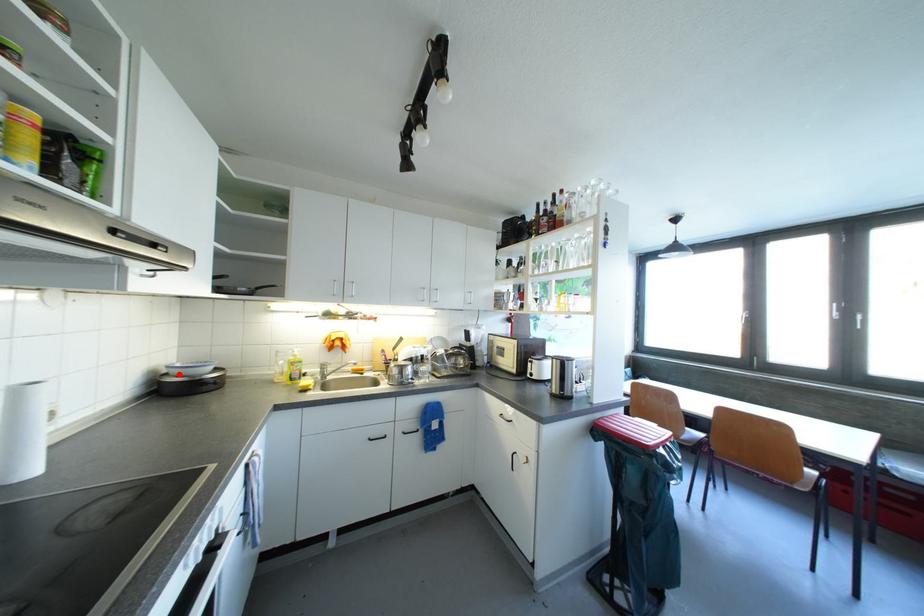
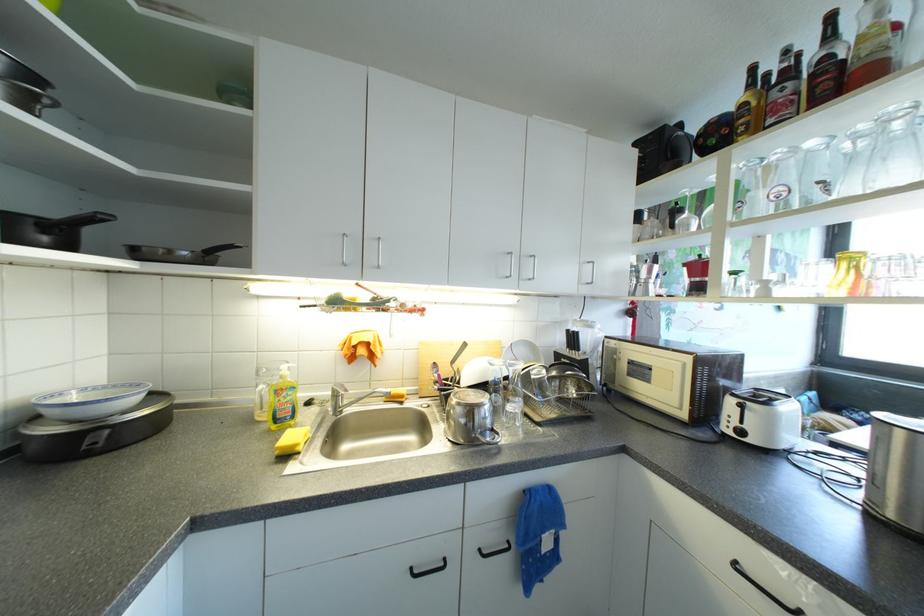
Where in the second image is the point corresponding to the highlighted location from the first image?

(55, 413)